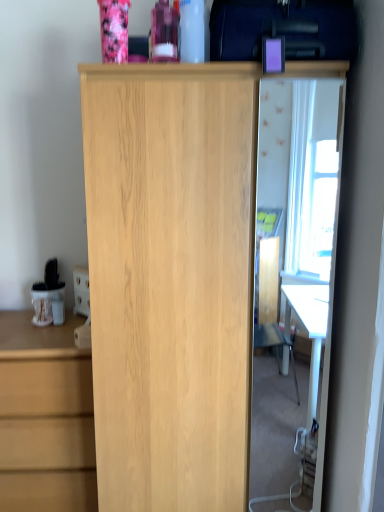
The image size is (384, 512). Describe the element at coordinates (316, 222) in the screenshot. I see `transparent glass door at center` at that location.

Image resolution: width=384 pixels, height=512 pixels. I want to click on transparent glass door at center, so click(316, 222).

In the scene shown: Measure the distance between light wood chest of drawers at left and camera.

light wood chest of drawers at left and camera are 1.55 meters apart.

The width and height of the screenshot is (384, 512). I want to click on purple plastic case at upper right, so coord(283,29).

This screenshot has width=384, height=512. I want to click on transparent glass door at center, so click(x=316, y=222).

How many degrees apart are the facing directions of light wood cupboard at center and purple plastic case at upper right?

The angle between the facing direction of light wood cupboard at center and the facing direction of purple plastic case at upper right is 1.05 degrees.

Between light wood cupboard at center and purple plastic case at upper right, which one has smaller size?

Smaller between the two is purple plastic case at upper right.

Which is further, (242, 212) or (320, 36)?

Positioned behind is point (242, 212).

Is point (135, 211) in front of point (76, 324)?

Yes, it is.

From a real-world perspective, does light wood cupboard at center stand above light wood chest of drawers at left?

Correct, in the physical world, light wood cupboard at center is higher than light wood chest of drawers at left.

Based on the photo, can you confirm if light wood cupboard at center is shorter than light wood chest of drawers at left?

In fact, light wood cupboard at center may be taller than light wood chest of drawers at left.

Considering the sizes of objects light wood cupboard at center and transparent glass door at center in the image provided, who is wider, light wood cupboard at center or transparent glass door at center?

light wood cupboard at center is wider.

Is light wood cupboard at center oriented towards transparent glass door at center?

Yes, light wood cupboard at center is facing transparent glass door at center.

Considering the positions of objects light wood cupboard at center and transparent glass door at center in the image provided, who is more to the right, light wood cupboard at center or transparent glass door at center?

From the viewer's perspective, transparent glass door at center appears more on the right side.

How many degrees apart are the facing directions of light wood cupboard at center and transparent glass door at center?

They differ by 1.05 degrees in their facing directions.

From a real-world perspective, is purple plastic case at upper right located beneath light wood cupboard at center?

No, from a real-world perspective, purple plastic case at upper right is not below light wood cupboard at center.

Would you say purple plastic case at upper right is inside or outside light wood cupboard at center?

purple plastic case at upper right cannot be found inside light wood cupboard at center.

Is purple plastic case at upper right aimed at light wood cupboard at center?

No, purple plastic case at upper right is not aimed at light wood cupboard at center.

From the picture: Who is shorter, purple plastic case at upper right or light wood cupboard at center?

With less height is purple plastic case at upper right.

Is transparent glass door at center thinner than light wood chest of drawers at left?

Indeed, transparent glass door at center has a lesser width compared to light wood chest of drawers at left.

How different are the orientations of transparent glass door at center and light wood chest of drawers at left in degrees?

There is a 1.4-degree angle between the facing directions of transparent glass door at center and light wood chest of drawers at left.

Looking at this image, from the image's perspective, would you say transparent glass door at center is shown under light wood chest of drawers at left?

No, from the image's perspective, transparent glass door at center is not beneath light wood chest of drawers at left.

Does transparent glass door at center touch purple plastic case at upper right?

transparent glass door at center and purple plastic case at upper right are clearly separated.

Is transparent glass door at center at the left side of purple plastic case at upper right?

No, transparent glass door at center is not to the left of purple plastic case at upper right.

Is transparent glass door at center situated inside purple plastic case at upper right or outside?

transparent glass door at center lies outside purple plastic case at upper right.

Is purple plastic case at upper right at the back of transparent glass door at center?

No, transparent glass door at center is not facing away from purple plastic case at upper right.

Considering the sizes of purple plastic case at upper right and transparent glass door at center in the image, is purple plastic case at upper right bigger or smaller than transparent glass door at center?

Considering their sizes, purple plastic case at upper right takes up more space than transparent glass door at center.

Is purple plastic case at upper right oriented away from transparent glass door at center?

No, transparent glass door at center is not at the back of purple plastic case at upper right.

From a real-world perspective, is purple plastic case at upper right located higher than transparent glass door at center?

Yes, from a real-world perspective, purple plastic case at upper right is on top of transparent glass door at center.

Where is `cupboard located on the left of purple plastic case at upper right`? The height and width of the screenshot is (512, 384). cupboard located on the left of purple plastic case at upper right is located at coordinates (171, 280).

Where is `the chest of drawers lying below the light wood cupboard at center (from the image's perspective)`? the chest of drawers lying below the light wood cupboard at center (from the image's perspective) is located at coordinates (45, 417).

Considering their positions, is light wood cupboard at center positioned closer to transparent glass door at center than light wood chest of drawers at left?

light wood chest of drawers at left is positioned closer to the anchor transparent glass door at center.

From the image, which object appears to be nearer to purple plastic case at upper right, light wood cupboard at center or light wood chest of drawers at left?

light wood cupboard at center is closer to purple plastic case at upper right.

Which object lies further to the anchor point light wood chest of drawers at left, transparent glass door at center or light wood cupboard at center?

The object further to light wood chest of drawers at left is transparent glass door at center.

When comparing their distances from light wood chest of drawers at left, does purple plastic case at upper right or transparent glass door at center seem closer?

purple plastic case at upper right is positioned closer to the anchor light wood chest of drawers at left.

When comparing their distances from transparent glass door at center, does light wood cupboard at center or purple plastic case at upper right seem further?

purple plastic case at upper right is positioned further to the anchor transparent glass door at center.

When comparing their distances from light wood chest of drawers at left, does light wood cupboard at center or purple plastic case at upper right seem further?

The object further to light wood chest of drawers at left is purple plastic case at upper right.

Based on their spatial positions, is light wood cupboard at center or transparent glass door at center further from purple plastic case at upper right?

transparent glass door at center.

When comparing their distances from light wood cupboard at center, does transparent glass door at center or purple plastic case at upper right seem further?

transparent glass door at center is positioned further to the anchor light wood cupboard at center.

Where is `cupboard between light wood chest of drawers at left and transparent glass door at center`? This screenshot has height=512, width=384. cupboard between light wood chest of drawers at left and transparent glass door at center is located at coordinates (171, 280).

I want to click on glass door between purple plastic case at upper right and light wood cupboard at center in the up-down direction, so click(x=316, y=222).

Find the location of `glass door between purple plastic case at upper right and light wood chest of drawers at left in the up-down direction`. glass door between purple plastic case at upper right and light wood chest of drawers at left in the up-down direction is located at coordinates (316, 222).

This screenshot has height=512, width=384. What are the coordinates of `cupboard between purple plastic case at upper right and light wood chest of drawers at left from top to bottom` in the screenshot? It's located at (171, 280).